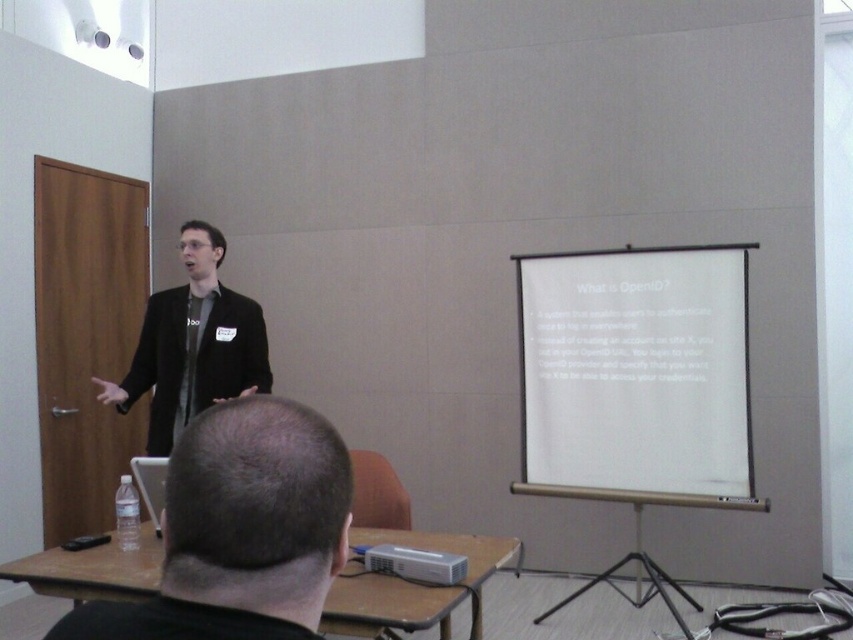
Question: Is black matte suit at center in front of silver metallic projector at lower center?

Choices:
 (A) no
 (B) yes

Answer: (A)

Question: Which object appears closest to the camera in this image?

Choices:
 (A) black hair at upper center
 (B) silver metallic projector at lower center
 (C) white matte projection screen at center right

Answer: (A)

Question: Which object appears closest to the camera in this image?

Choices:
 (A) white matte projection screen at center right
 (B) black hair at upper center

Answer: (B)

Question: Can you confirm if white matte projection screen at center right is positioned to the left of black hair at upper center?

Choices:
 (A) no
 (B) yes

Answer: (A)

Question: Which object is closer to the camera taking this photo?

Choices:
 (A) silver metallic projector at lower center
 (B) white matte projection screen at center right
 (C) black matte suit at center
 (D) black hair at upper center

Answer: (D)

Question: Can you confirm if white matte projection screen at center right is smaller than silver metallic projector at lower center?

Choices:
 (A) yes
 (B) no

Answer: (B)